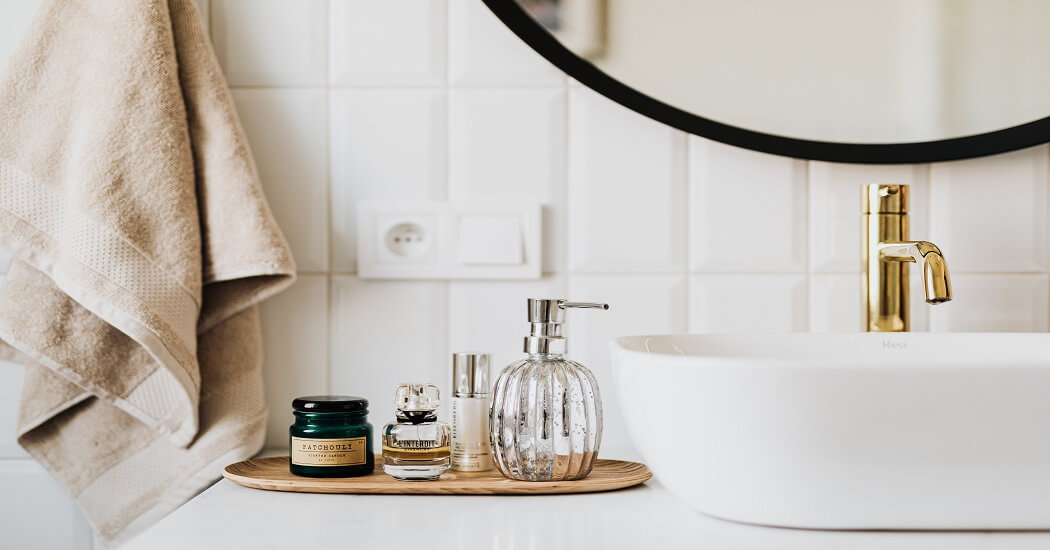
Find the location of a particular element. The image size is (1050, 550). jar is located at coordinates coord(345,456).